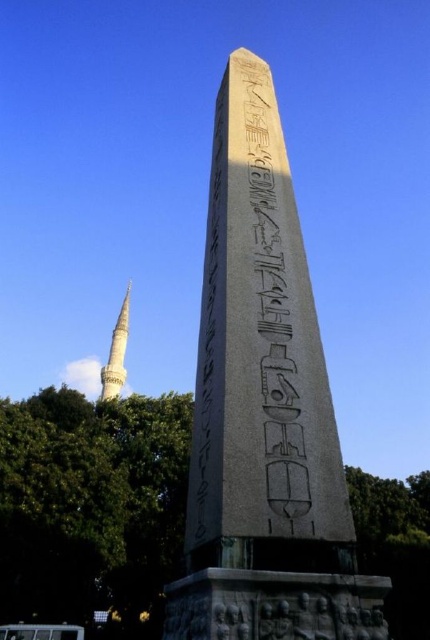
Question: Estimate the real-world distances between objects in this image. Which object is closer to the green leafy tree at center?

Choices:
 (A) bronze textured obelisk at center
 (B) white glossy minaret at lower left
 (C) black stone hieroglyphs at center

Answer: (C)

Question: Which object is positioned closest to the green leafy tree at center?

Choices:
 (A) white glossy minaret at lower left
 (B) black stone hieroglyphs at center

Answer: (B)

Question: In this image, where is bronze textured obelisk at center located relative to black stone hieroglyphs at center?

Choices:
 (A) right
 (B) left

Answer: (A)

Question: Does green leafy tree at center appear over black stone hieroglyphs at center?

Choices:
 (A) no
 (B) yes

Answer: (A)

Question: Is bronze textured obelisk at center positioned at the back of white glossy minaret at lower left?

Choices:
 (A) yes
 (B) no

Answer: (B)

Question: Among these points, which one is nearest to the camera?

Choices:
 (A) (212, 387)
 (B) (39, 474)

Answer: (A)